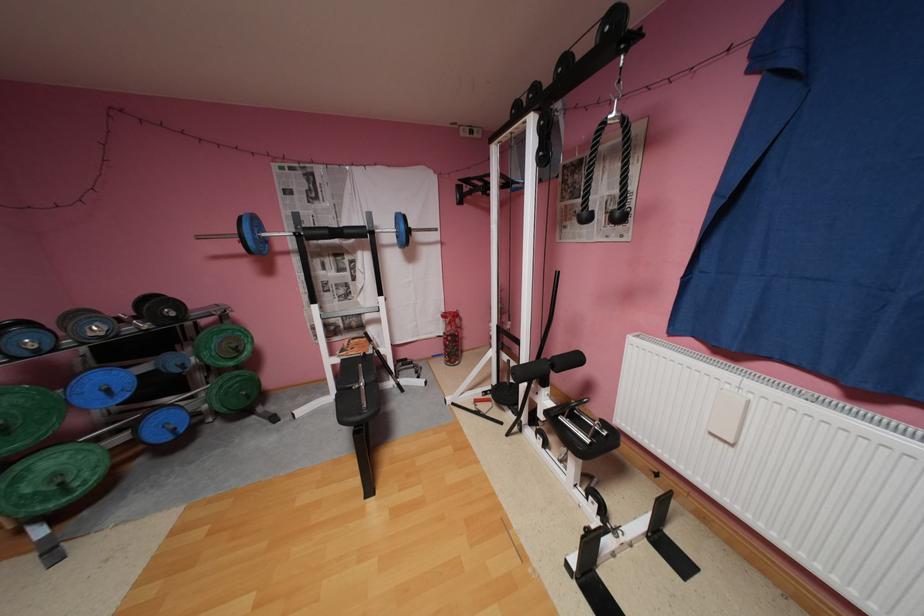
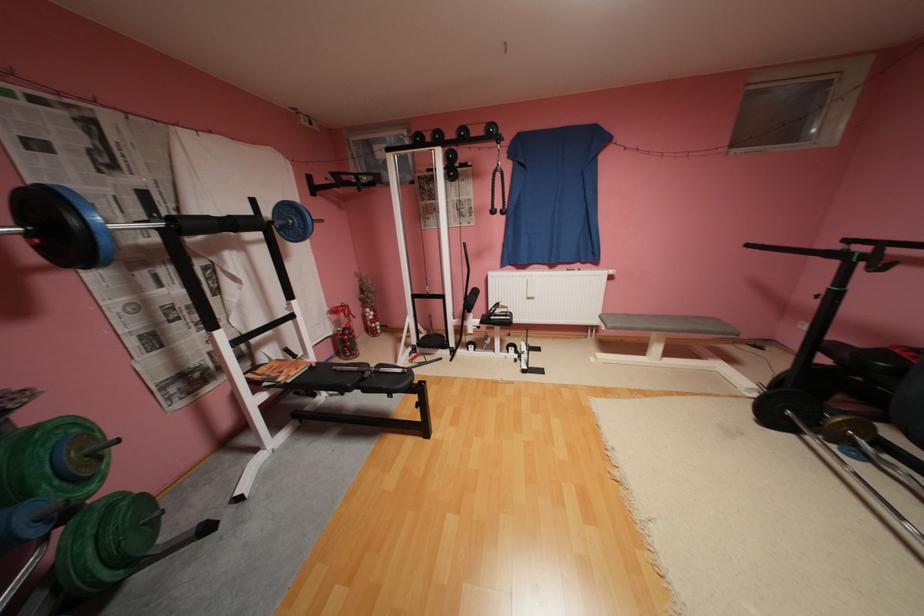
Find the pixel in the second image that matches (x=224, y=391) in the first image.

(100, 551)